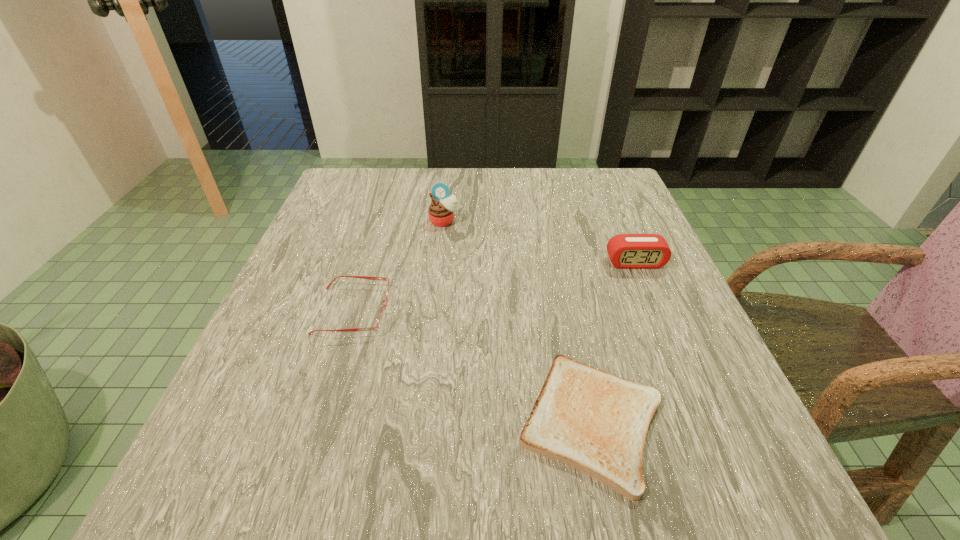
Find the location of `vacant region located on the lenses of the third farthest object`. vacant region located on the lenses of the third farthest object is located at coordinates (434, 310).

Where is `vacant space located on the left of the shortest object`? vacant space located on the left of the shortest object is located at coordinates (391, 421).

Where is `object that is at the far edge`? object that is at the far edge is located at coordinates (442, 209).

This screenshot has width=960, height=540. In order to click on object positioned at the near edge in this screenshot , I will do `click(586, 418)`.

Locate an element on the screen. The image size is (960, 540). object that is positioned at the left edge is located at coordinates (381, 318).

You are a GUI agent. You are given a task and a screenshot of the screen. Output one action in this format:
    pyautogui.click(x=<x>, y=<y>)
    Task: Click on the alarm clock located at the right edge
    The image size is (960, 540).
    Given the screenshot: What is the action you would take?
    pyautogui.click(x=628, y=251)

Locate an element on the screen. toast located at the right edge is located at coordinates (586, 418).

You are a GUI agent. You are given a task and a screenshot of the screen. Output one action in this format:
    pyautogui.click(x=<x>, y=<y>)
    Task: Click on the object present at the near right corner
    The width and height of the screenshot is (960, 540).
    Given the screenshot: What is the action you would take?
    pyautogui.click(x=586, y=418)

Identify the location of vacant space at the far edge. The image size is (960, 540). (561, 200).

In the image, there is a desktop. What are the coordinates of `blank space at the near edge` in the screenshot? It's located at (590, 500).